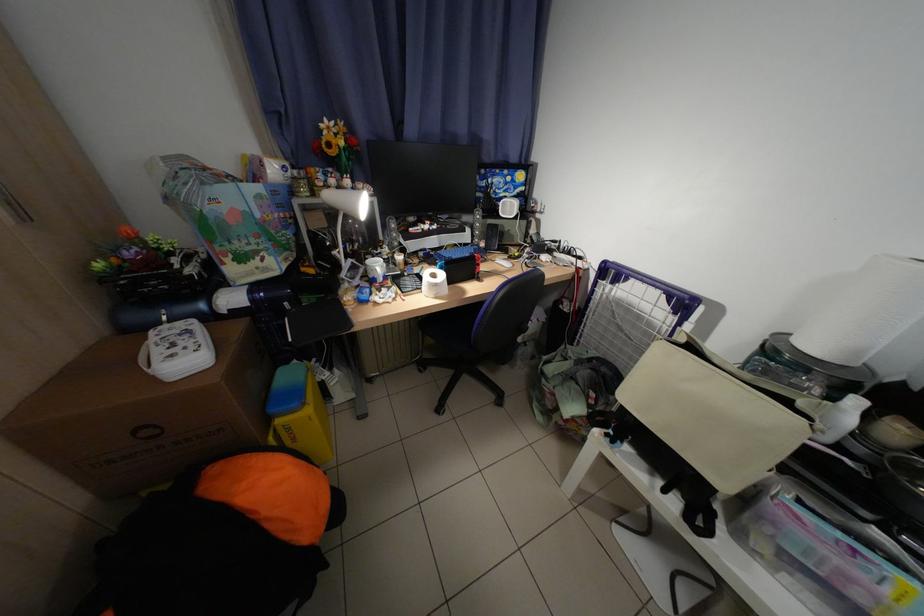
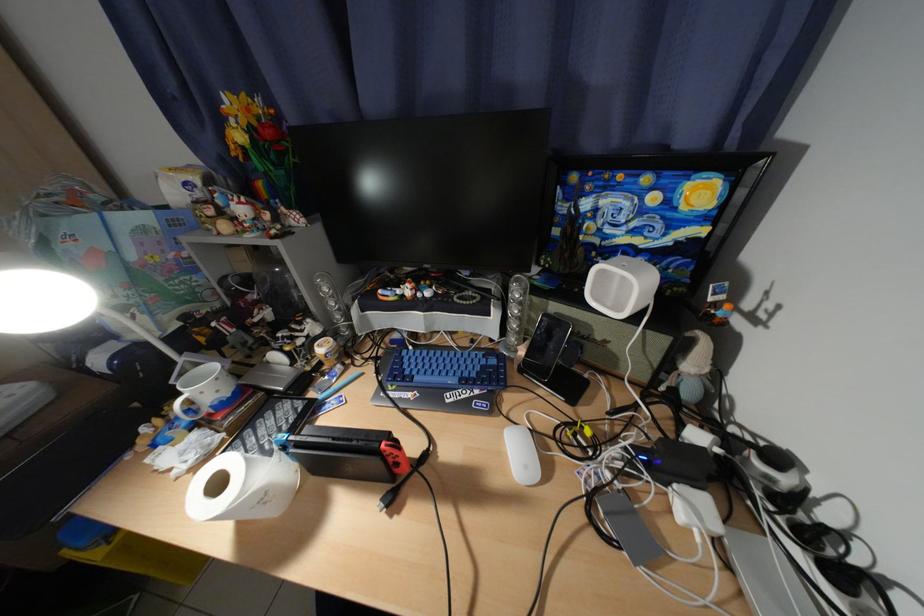
Find the pixel in the second image that matches point (490, 265) in the first image.

(408, 466)